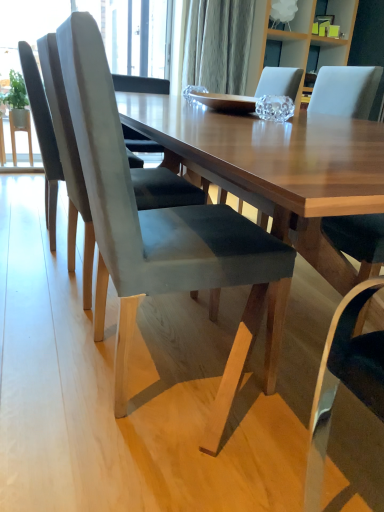
Question: From the image's perspective, relative to suede gray chair at left, which is the second chair in back-to-front order, is wooden table at center above or below?

Choices:
 (A) below
 (B) above

Answer: (A)

Question: From a real-world perspective, is wooden table at center above or below suede gray chair at left, arranged as the 2th chair when viewed from the front?

Choices:
 (A) below
 (B) above

Answer: (A)

Question: Based on their relative distances, which object is nearer to the suede gray chair at center, which is the 1th chair in front-to-back order?

Choices:
 (A) suede gray chair at left, arranged as the 2th chair when viewed from the front
 (B) wooden table at center
 (C) suede gray chair at left, which is the 3th chair from front to back

Answer: (B)

Question: Which object is the closest to the suede gray chair at left, which is the second chair in back-to-front order?

Choices:
 (A) wooden table at center
 (B) suede gray chair at left, acting as the 1th chair starting from the back
 (C) suede gray chair at center, acting as the third chair starting from the back

Answer: (B)